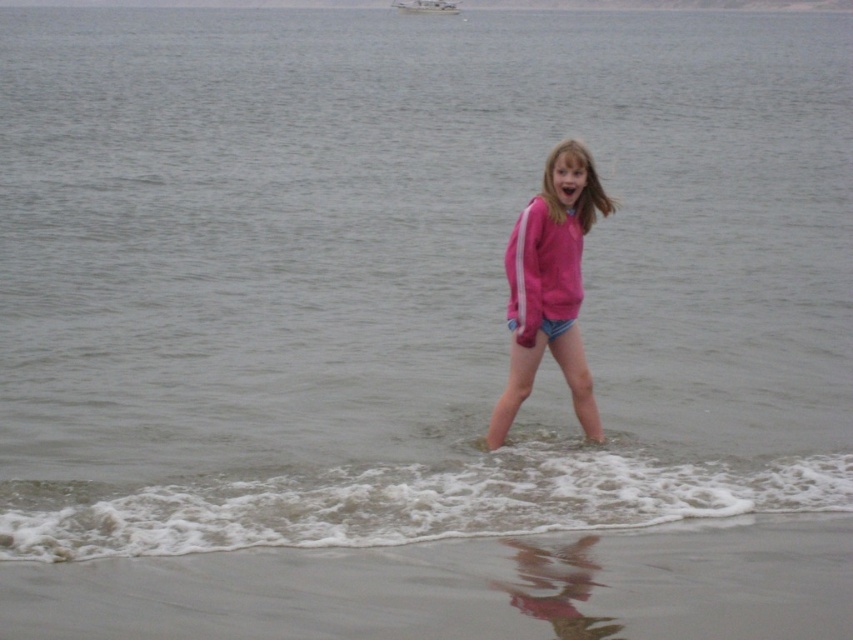
You are a photographer trying to capture the girl in the image. To ensure the sandy beach at lower center and the pink fabric shorts at center are both clearly visible in the frame, which object should you focus on first?

The sandy beach at lower center is shorter than the pink fabric shorts at center, so you should focus on the pink fabric shorts at center first to ensure both are in focus.

You are a photographer trying to capture the girl in the pink fabric shorts at center and the white plastic boat at upper center in the same frame. Based on their sizes in the image, which object would appear more prominent in the photo?

The pink fabric shorts at center would appear more prominent in the photo because it has a larger size compared to the white plastic boat at upper center.